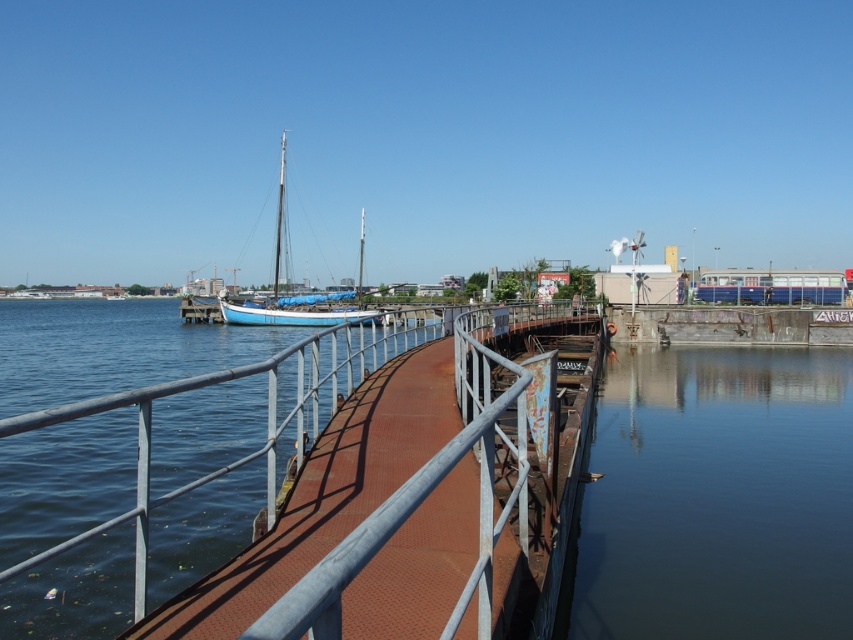
Can you confirm if rusty metal rail at center is smaller than blue matte sailboat at center?

Indeed, rusty metal rail at center has a smaller size compared to blue matte sailboat at center.

I want to click on rusty metal rail at center, so coord(328,468).

Locate an element on the screen. The image size is (853, 640). rusty metal rail at center is located at coordinates (328, 468).

Between dark blue water at lower right and blue matte sailboat at center, which one is positioned higher?

Positioned higher is blue matte sailboat at center.

Is point (616, 538) farther from viewer compared to point (288, 317)?

No, it is in front of (288, 317).

At what (x,y) coordinates should I click in order to perform the action: click on dark blue water at lower right. Please return your answer as a coordinate pair (x, y). Looking at the image, I should click on (717, 497).

I want to click on dark blue water at lower right, so click(717, 497).

Which is more to the right, dark blue water at lower right or rusty metal rail at center?

From the viewer's perspective, dark blue water at lower right appears more on the right side.

From the picture: Can you confirm if dark blue water at lower right is shorter than rusty metal rail at center?

Yes, dark blue water at lower right is shorter than rusty metal rail at center.

This screenshot has height=640, width=853. I want to click on dark blue water at lower right, so click(x=717, y=497).

This screenshot has height=640, width=853. I want to click on dark blue water at lower right, so click(x=717, y=497).